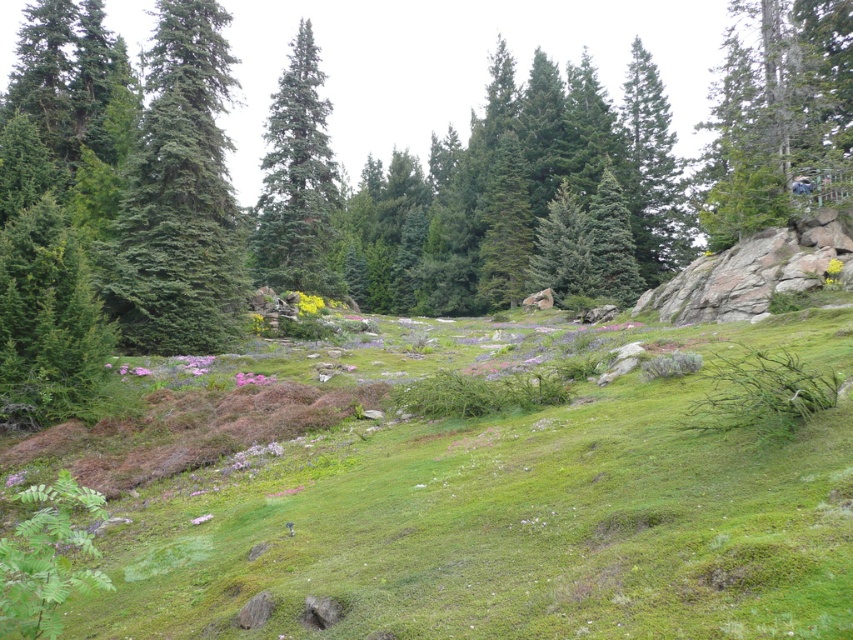
You are standing at the camera position looking at the landscape. There are two points marked in the image, one at coordinate point (498,541) and another at point (202,248). Which point is closer to you?

Point (498,541) is closer to the camera than point (202,248).

You are standing at the center of the image and want to walk to the green grassy area at lower left located at point (514, 518). Which direction should you face to walk directly towards it?

You should face towards the lower left direction to walk directly towards the green grassy area at lower left located at point (514, 518).